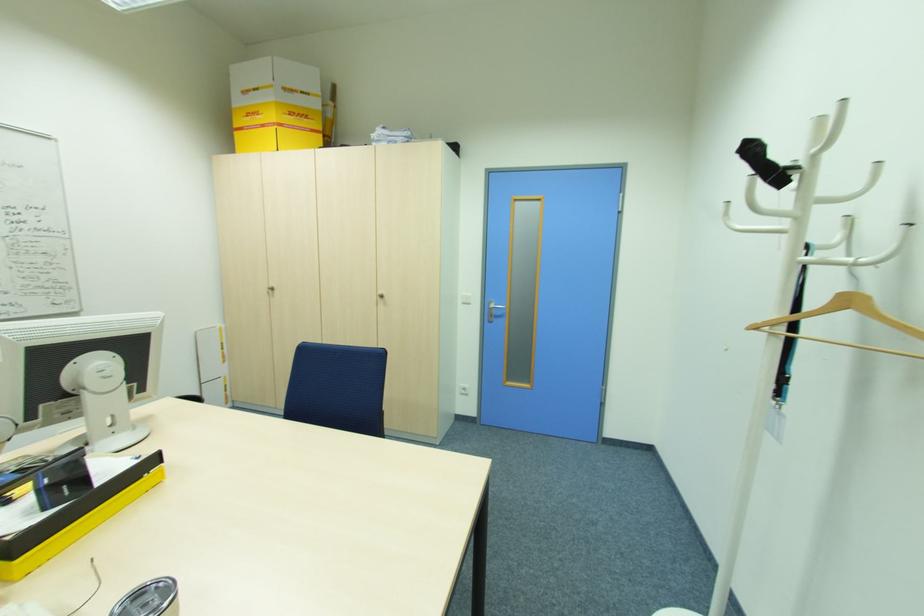
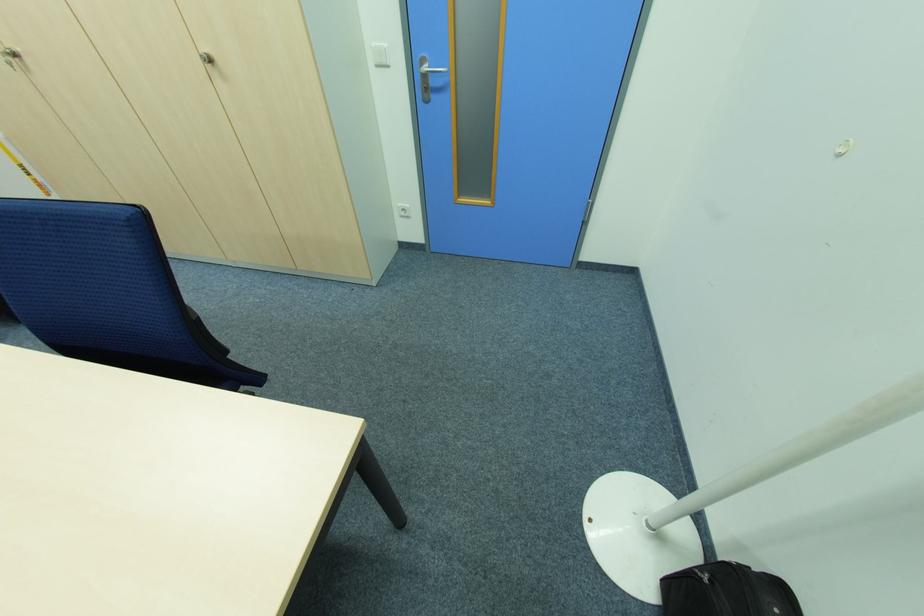
The point at (384,297) is marked in the first image. Where is the corresponding point in the second image?

(213, 62)